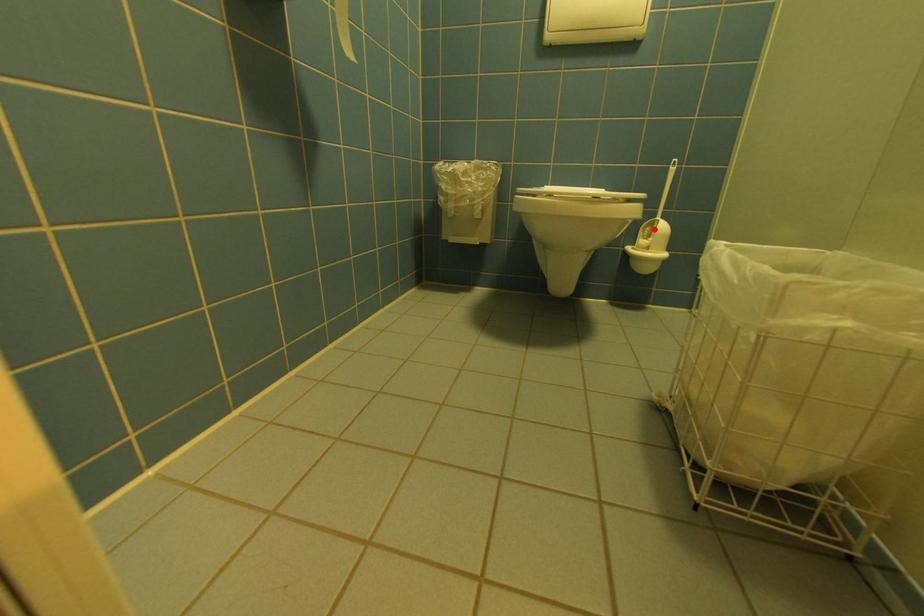
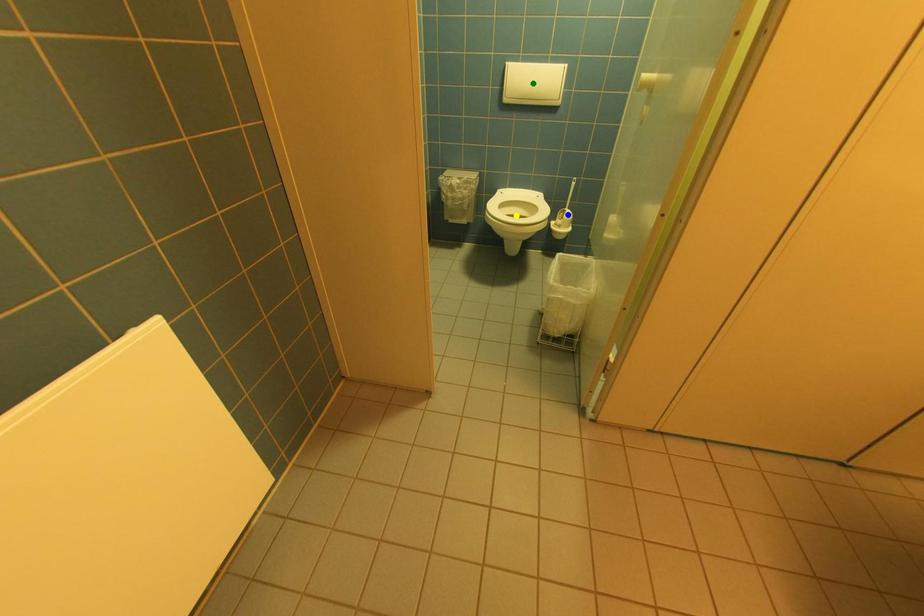
Question: I am providing you with two images of the same scene from different viewpoints. A red point is marked on the first image. You are given multiple points on the second image. Which mark in image 2 goes with the point in image 1?

Choices:
 (A) green point
 (B) blue point
 (C) yellow point

Answer: (B)